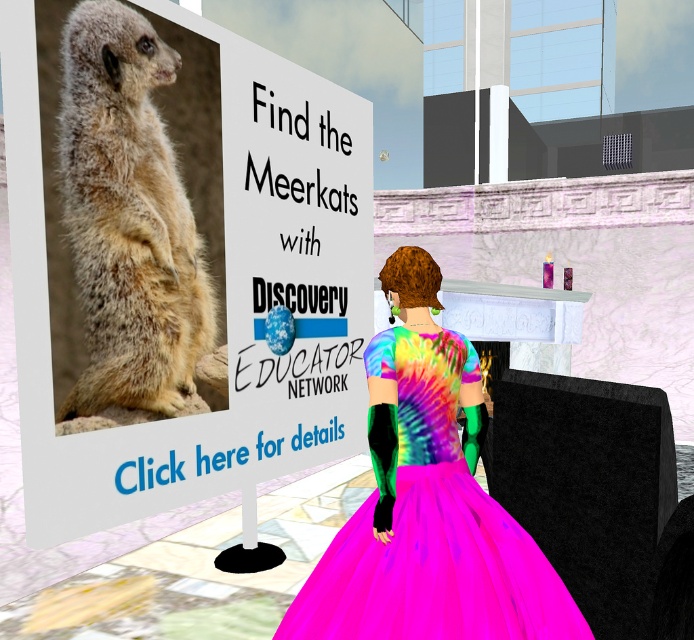
Is natural fur meerkat at upper left positioned behind neon pink taffeta dress at center?

Yes, natural fur meerkat at upper left is behind neon pink taffeta dress at center.

Is natural fur meerkat at upper left wider than neon pink taffeta dress at center?

Yes, natural fur meerkat at upper left is wider than neon pink taffeta dress at center.

Which is in front, point (353, 141) or point (400, 604)?

Point (400, 604) is more forward.

Locate an element on the screen. This screenshot has width=694, height=640. natural fur meerkat at upper left is located at coordinates (177, 259).

Locate an element on the screen. light brown fur meerkat at center is located at coordinates (128, 218).

Which is behind, point (178, 284) or point (452, 632)?

The point (178, 284) is more distant.

This screenshot has height=640, width=694. Identify the location of light brown fur meerkat at center. (128, 218).

Where is `light brown fur meerkat at center`? The image size is (694, 640). light brown fur meerkat at center is located at coordinates (128, 218).

Between natural fur meerkat at upper left and light brown fur meerkat at center, which one is positioned higher?

Positioned higher is light brown fur meerkat at center.

Is natural fur meerkat at upper left below light brown fur meerkat at center?

Yes, natural fur meerkat at upper left is below light brown fur meerkat at center.

The image size is (694, 640). Find the location of `natural fur meerkat at upper left`. natural fur meerkat at upper left is located at coordinates (177, 259).